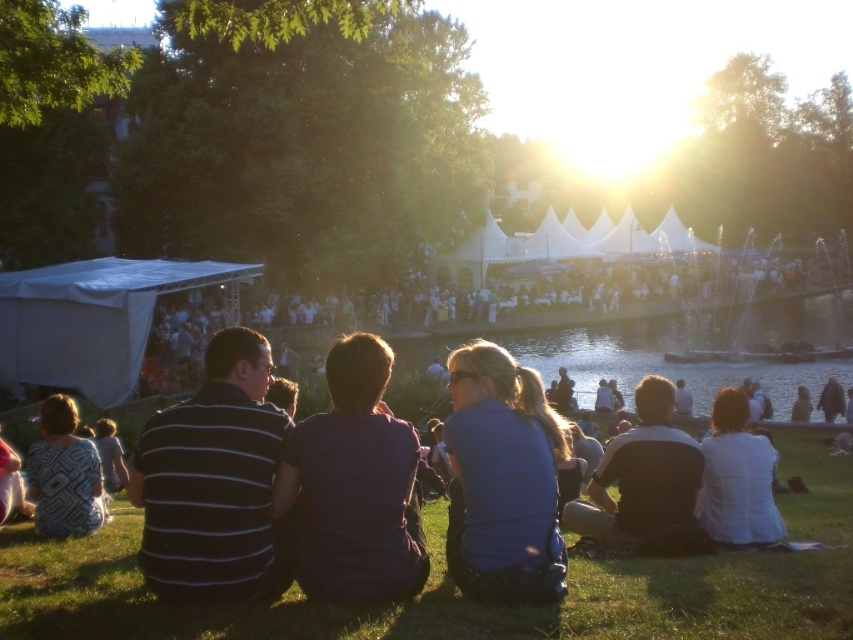
Question: Which point appears closest to the camera in this image?

Choices:
 (A) (32, 499)
 (B) (701, 579)
 (C) (523, 593)
 (D) (192, 524)

Answer: (D)

Question: Is white fabric tent at left behind white matte shirt at lower right?

Choices:
 (A) yes
 (B) no

Answer: (A)

Question: Which point appears farthest from the camera in this image?

Choices:
 (A) (93, 515)
 (B) (346, 524)
 (C) (241, 532)

Answer: (A)

Question: Is green grass at lower center positioned in front of white matte shirt at lower right?

Choices:
 (A) no
 (B) yes

Answer: (B)

Question: Is white matte shirt at lower right wider than patterned fabric dress at lower left?

Choices:
 (A) no
 (B) yes

Answer: (B)

Question: Which object is farther from the camera taking this photo?

Choices:
 (A) green grass at lower center
 (B) dark gray shirt at center
 (C) white matte shirt at lower right
 (D) dark purple fabric shirt at center

Answer: (C)